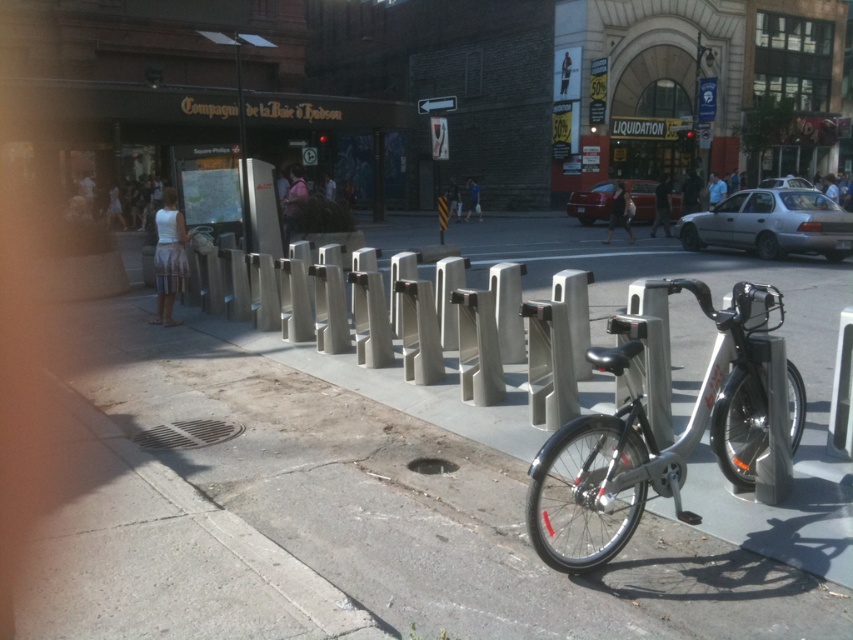
Question: Can you confirm if gray concrete sidewalk at center is positioned to the right of silver metallic bicycle at center?

Choices:
 (A) yes
 (B) no

Answer: (A)

Question: Does gray concrete sidewalk at center appear on the right side of silver metallic bicycle at center?

Choices:
 (A) yes
 (B) no

Answer: (A)

Question: Does gray concrete sidewalk at center appear under silver metallic bicycle at center?

Choices:
 (A) yes
 (B) no

Answer: (A)

Question: Among these points, which one is nearest to the camera?

Choices:
 (A) (584, 420)
 (B) (320, 440)

Answer: (A)